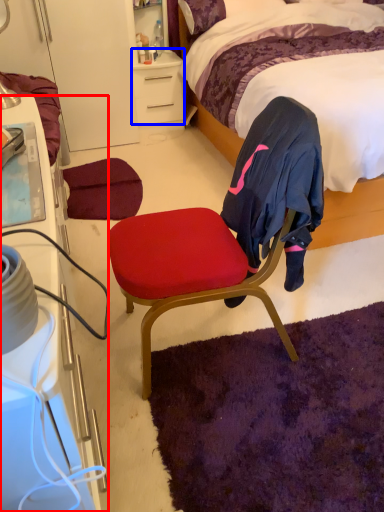
Question: Which object appears farthest to the camera in this image, cabinetry (highlighted by a red box) or desk (highlighted by a blue box)?

Choices:
 (A) cabinetry
 (B) desk

Answer: (B)